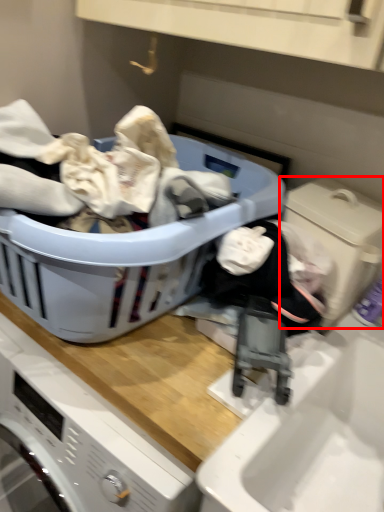
Question: From the image's perspective, what is the correct spatial relationship of washing machine (annotated by the red box) in relation to laundry basket?

Choices:
 (A) below
 (B) above

Answer: (A)